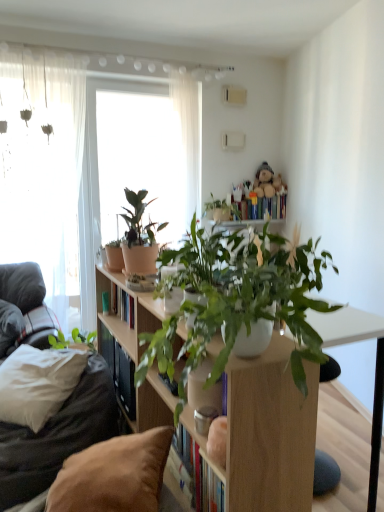
What do you see at coordinates (194, 260) in the screenshot? I see `green glossy plant at center, which is the 1th houseplant in front-to-back order` at bounding box center [194, 260].

How much space does green glossy plant at center, the 2th houseplant in the back-to-front sequence, occupy horizontally?

green glossy plant at center, the 2th houseplant in the back-to-front sequence, is 30.60 centimeters wide.

I want to click on fluffy beige teddy bear at upper center, so click(x=264, y=181).

The image size is (384, 512). Identify the location of wooden bookshelf at center. (114, 312).

Visually, is white matte bookcase at center positioned to the left or to the right of fluffy beige teddy bear at upper center?

white matte bookcase at center is positioned on fluffy beige teddy bear at upper center's left side.

Considering the positions of objects white matte bookcase at center and fluffy beige teddy bear at upper center in the image provided, who is behind, white matte bookcase at center or fluffy beige teddy bear at upper center?

fluffy beige teddy bear at upper center is more distant.

Is fluffy beige teddy bear at upper center surrounded by white matte bookcase at center?

Actually, fluffy beige teddy bear at upper center is outside white matte bookcase at center.

Between point (6, 329) and point (189, 130), which one is positioned in front?

The point (6, 329) is more forward.

Which is in front, white soft pillow at left, placed as the 2th pillow when sorted from bottom to top, or white sheer curtain at upper center?

white soft pillow at left, placed as the 2th pillow when sorted from bottom to top.

Considering the sizes of white soft pillow at left, placed as the 2th pillow when sorted from bottom to top, and white sheer curtain at upper center in the image, is white soft pillow at left, placed as the 2th pillow when sorted from bottom to top, taller or shorter than white sheer curtain at upper center?

Clearly, white soft pillow at left, placed as the 2th pillow when sorted from bottom to top, is shorter compared to white sheer curtain at upper center.

Between hardcover books at upper center and brown fabric pillow at lower left, arranged as the 2th pillow when viewed from the back, which one is positioned in front?

brown fabric pillow at lower left, arranged as the 2th pillow when viewed from the back.

Are hardcover books at upper center and brown fabric pillow at lower left, marked as the 1th pillow in a front-to-back arrangement, making contact?

No, hardcover books at upper center is not in contact with brown fabric pillow at lower left, marked as the 1th pillow in a front-to-back arrangement.

Would you say hardcover books at upper center is to the left or to the right of brown fabric pillow at lower left, the 1th pillow positioned from the right, in the picture?

Based on their positions, hardcover books at upper center is located to the right of brown fabric pillow at lower left, the 1th pillow positioned from the right.

From the image's perspective, is hardcover books at upper center below brown fabric pillow at lower left, arranged as the 2th pillow when viewed from the back?

Incorrect, from the image's perspective, hardcover books at upper center is higher than brown fabric pillow at lower left, arranged as the 2th pillow when viewed from the back.

Which of these two, brown fabric couch at left or white matte bookcase at center, is wider?

With larger width is white matte bookcase at center.

What's the angular difference between brown fabric couch at left and white matte bookcase at center's facing directions?

They differ by 0.868 degrees in their facing directions.

Do you think brown fabric couch at left is within white matte bookcase at center, or outside of it?

brown fabric couch at left is spatially situated outside white matte bookcase at center.

Is brown fabric couch at left oriented towards white matte bookcase at center?

No, brown fabric couch at left is not turned towards white matte bookcase at center.

Is hardcover books at upper center spatially inside wooden bookshelf at center, or outside of it?

hardcover books at upper center cannot be found inside wooden bookshelf at center.

Are hardcover books at upper center and wooden bookshelf at center beside each other?

hardcover books at upper center and wooden bookshelf at center are clearly separated.

Which object is closer to the camera taking this photo, hardcover books at upper center or wooden bookshelf at center?

wooden bookshelf at center is in front.

Looking at this image, which is more to the left, hardcover books at upper center or wooden bookshelf at center?

From the viewer's perspective, wooden bookshelf at center appears more on the left side.

From the image's perspective, is hardcover books at upper center located above or below fluffy beige teddy bear at upper center?

Based on their image positions, hardcover books at upper center is located beneath fluffy beige teddy bear at upper center.

Between hardcover books at upper center and fluffy beige teddy bear at upper center, which one has smaller size?

hardcover books at upper center.

Can you confirm if hardcover books at upper center is wider than fluffy beige teddy bear at upper center?

In fact, hardcover books at upper center might be narrower than fluffy beige teddy bear at upper center.

Is brown fabric couch at left oriented away from white sheer curtain at upper center?

No, brown fabric couch at left is not facing away from white sheer curtain at upper center.

Relative to white sheer curtain at upper center, is brown fabric couch at left in front or behind?

Clearly, brown fabric couch at left is in front of white sheer curtain at upper center.

Which point is more forward, (x=97, y=399) or (x=171, y=96)?

Point (x=97, y=399)

Is brown fabric couch at left not near white sheer curtain at upper center?

Indeed, brown fabric couch at left is not near white sheer curtain at upper center.

Find the location of a particular element. This screenshot has width=384, height=512. toy behind the white matte bookcase at center is located at coordinates (264, 181).

This screenshot has width=384, height=512. Identify the location of the 2nd pillow to the left when counting from the white sheer curtain at upper center. (9, 326).

Which object lies nearer to the anchor point translucent fabric at left, the 1th window in the left-to-right sequence, hardcover books at upper center or white soft pillow at left, which is counted as the second pillow, starting from the front?

Among the two, white soft pillow at left, which is counted as the second pillow, starting from the front, is located nearer to translucent fabric at left, the 1th window in the left-to-right sequence.

Looking at the image, which one is located closer to white soft pillow at left, the 1th pillow from the back, white sheer curtain at upper center or translucent fabric at left, which is the second window from right to left?

Based on the image, translucent fabric at left, which is the second window from right to left, appears to be nearer to white soft pillow at left, the 1th pillow from the back.

Based on the photo, when comparing their distances from green glossy plant at center, the 2th houseplant in the back-to-front sequence, does white matte bookcase at center or brown fabric couch at left seem further?

brown fabric couch at left is positioned further to the anchor green glossy plant at center, the 2th houseplant in the back-to-front sequence.

Estimate the real-world distances between objects in this image. Which object is closer to brown fabric pillow at lower left, the 1th pillow positioned from the right, wooden bookshelf at center or white sheer curtain at upper center?

The object closer to brown fabric pillow at lower left, the 1th pillow positioned from the right, is wooden bookshelf at center.

When comparing their distances from transparent glass window at center, the first window viewed from the right, does white sheer curtain at upper center or brown fabric pillow at lower left, which is the 1th pillow from bottom to top, seem further?

brown fabric pillow at lower left, which is the 1th pillow from bottom to top, is further to transparent glass window at center, the first window viewed from the right.

Which object lies nearer to the anchor point fluffy beige teddy bear at upper center, brown fabric pillow at lower left, marked as the 1th pillow in a front-to-back arrangement, or matte terracotta pot at upper left, which is counted as the first houseplant, starting from the back?

matte terracotta pot at upper left, which is counted as the first houseplant, starting from the back, is closer to fluffy beige teddy bear at upper center.

Looking at the image, which one is located closer to green glossy plant at center, the 2th houseplant in the back-to-front sequence, white soft pillow at left, placed as the second pillow when sorted from right to left, or hardcover books at upper center?

Among the two, white soft pillow at left, placed as the second pillow when sorted from right to left, is located nearer to green glossy plant at center, the 2th houseplant in the back-to-front sequence.

Estimate the real-world distances between objects in this image. Which object is closer to hardcover books at upper center, brown fabric couch at left or transparent glass window at center, the second window in the left-to-right sequence?

transparent glass window at center, the second window in the left-to-right sequence, is closer to hardcover books at upper center.

Where is `couch between white matte bookcase at center and matte terracotta pot at upper left, which is counted as the first houseplant, starting from the back, from front to back`? Image resolution: width=384 pixels, height=512 pixels. couch between white matte bookcase at center and matte terracotta pot at upper left, which is counted as the first houseplant, starting from the back, from front to back is located at coordinates (57, 436).

Where is `toy between white matte bookcase at center and hardcover books at upper center along the z-axis`? toy between white matte bookcase at center and hardcover books at upper center along the z-axis is located at coordinates (264, 181).

At what (x,y) coordinates should I click in order to perform the action: click on shelf that lies between white sheer curtain at upper center and white soft pillow at left, placed as the second pillow when sorted from right to left, from top to bottom. Please return your answer as a coordinate pair (x, y). Image resolution: width=384 pixels, height=512 pixels. Looking at the image, I should click on (114, 312).

This screenshot has height=512, width=384. Find the location of `window located between brown fabric pillow at lower left, the 2th pillow in the top-to-bottom sequence, and white sheer curtain at upper center in the depth direction`. window located between brown fabric pillow at lower left, the 2th pillow in the top-to-bottom sequence, and white sheer curtain at upper center in the depth direction is located at coordinates (44, 174).